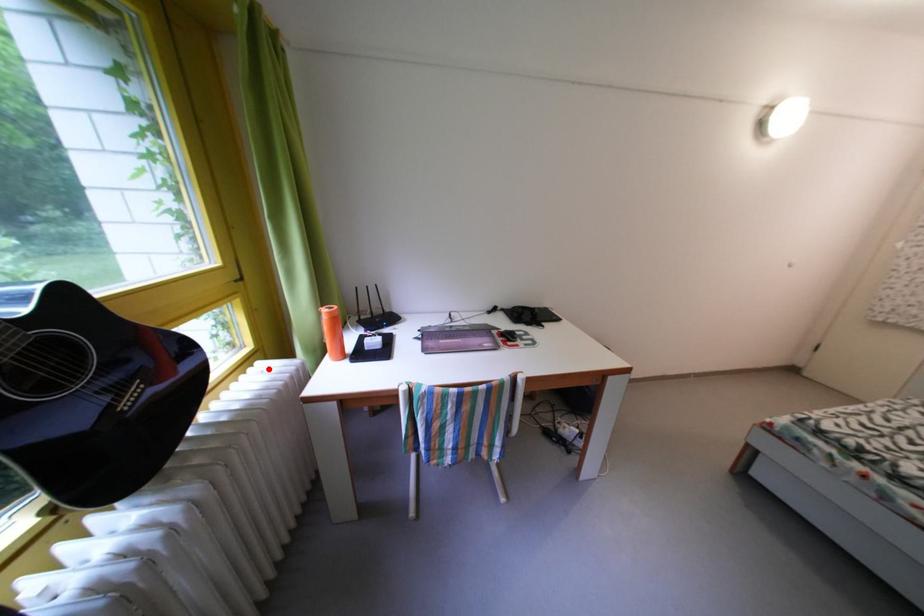
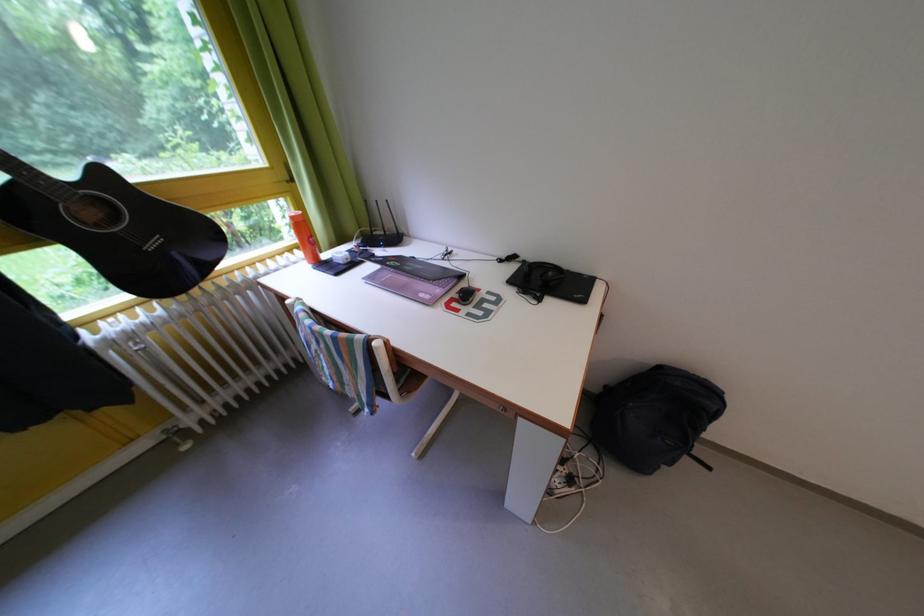
Where in the second image is the point corresponding to the highlighted location from the first image?

(305, 257)